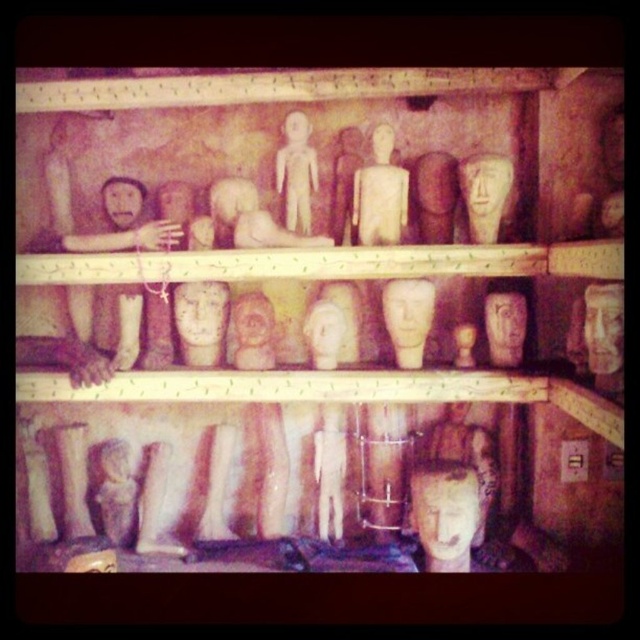
In the scene shown: You are an artist planning to display two wooden sculptures on a narrow shelf. You have the matte wooden mask at center and the matte wooden figure at upper center. Based on their sizes, which sculpture should you choose to fit better on the shelf?

The matte wooden figure at upper center has a smaller width compared to the matte wooden mask at center, so it would fit better on a narrow shelf.